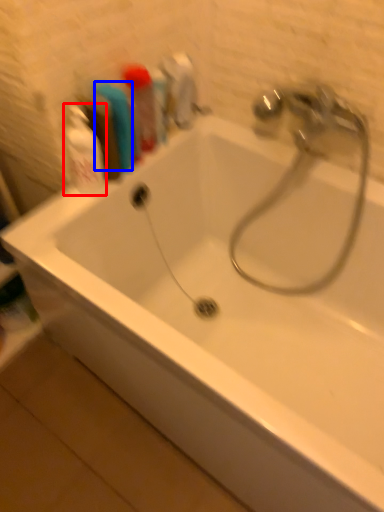
Question: Which of the following is the closest to the observer, cleaning product (highlighted by a red box) or toiletry (highlighted by a blue box)?

Choices:
 (A) cleaning product
 (B) toiletry

Answer: (A)